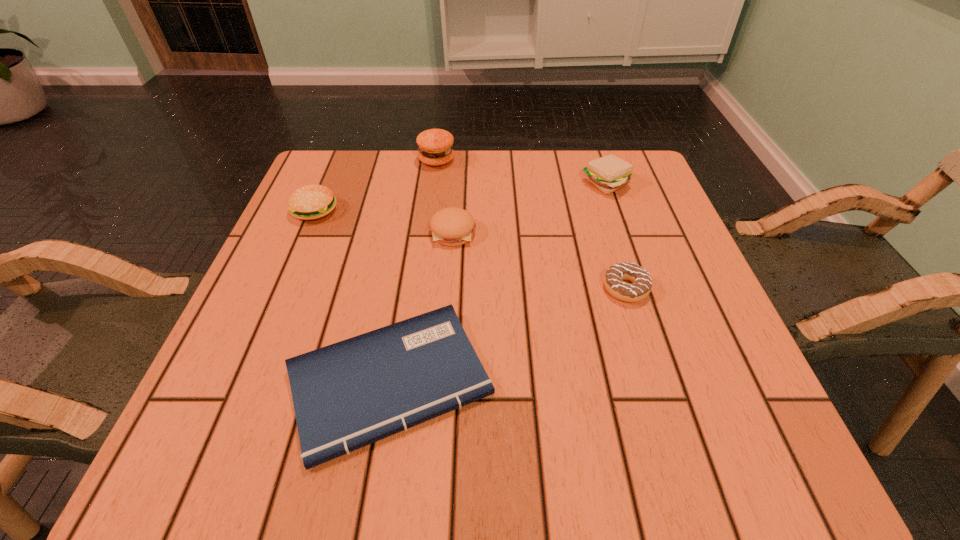
At what (x,y) coordinates should I click in order to perform the action: click on the closest object relative to the doughnut. Please return your answer as a coordinate pair (x, y). Looking at the image, I should click on (347, 395).

I want to click on the closest object to the farthest patty, so click(x=452, y=226).

At what (x,y) coordinates should I click in order to perform the action: click on patty that is the second closest to the farthest object. Please return your answer as a coordinate pair (x, y). Looking at the image, I should click on (309, 202).

Image resolution: width=960 pixels, height=540 pixels. Identify the location of the third closest patty to the leftmost object. (609, 173).

Identify the location of free point that satisfies the following two spatial constraints: 1. on the back side of the paperback book; 2. on the left side of the rightmost patty. (421, 184).

Find the location of a particular element. The width and height of the screenshot is (960, 540). free spot that satisfies the following two spatial constraints: 1. on the back side of the rightmost patty; 2. on the left side of the nearest object is located at coordinates (x=421, y=184).

Where is `blank space that satisfies the following two spatial constraints: 1. on the back side of the leftmost object; 2. on the left side of the rightmost patty`? This screenshot has width=960, height=540. blank space that satisfies the following two spatial constraints: 1. on the back side of the leftmost object; 2. on the left side of the rightmost patty is located at coordinates (326, 184).